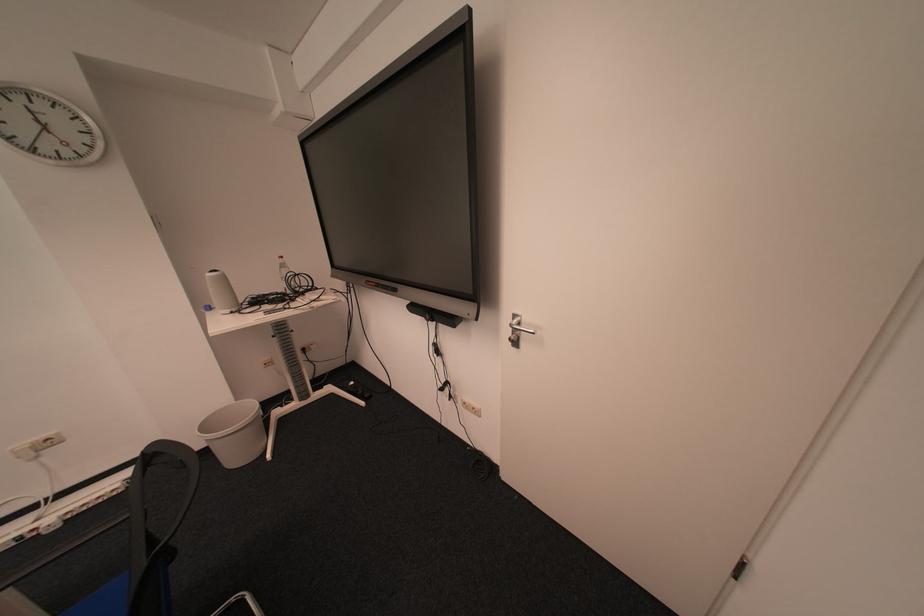
Where is `silver door handle`? Image resolution: width=924 pixels, height=616 pixels. silver door handle is located at coordinates (520, 329).